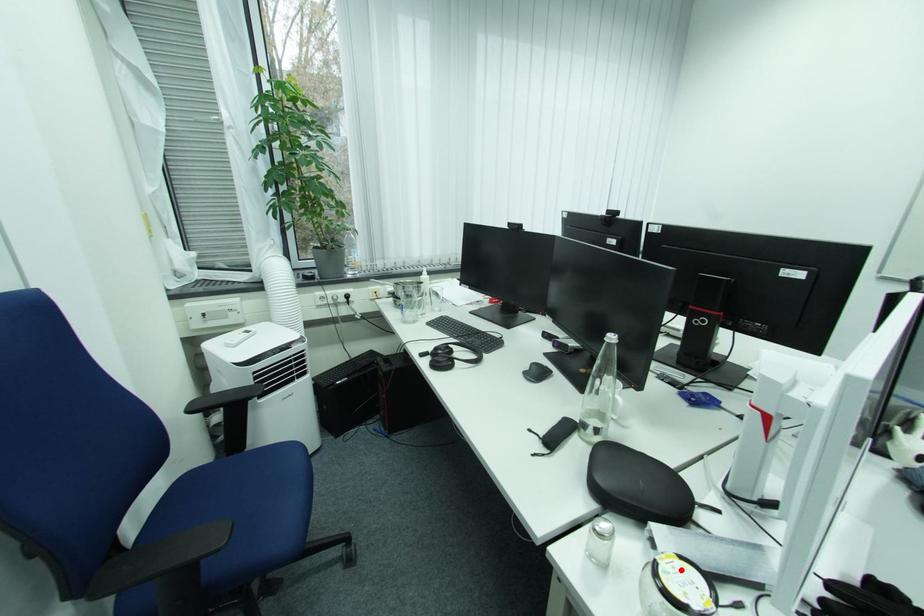
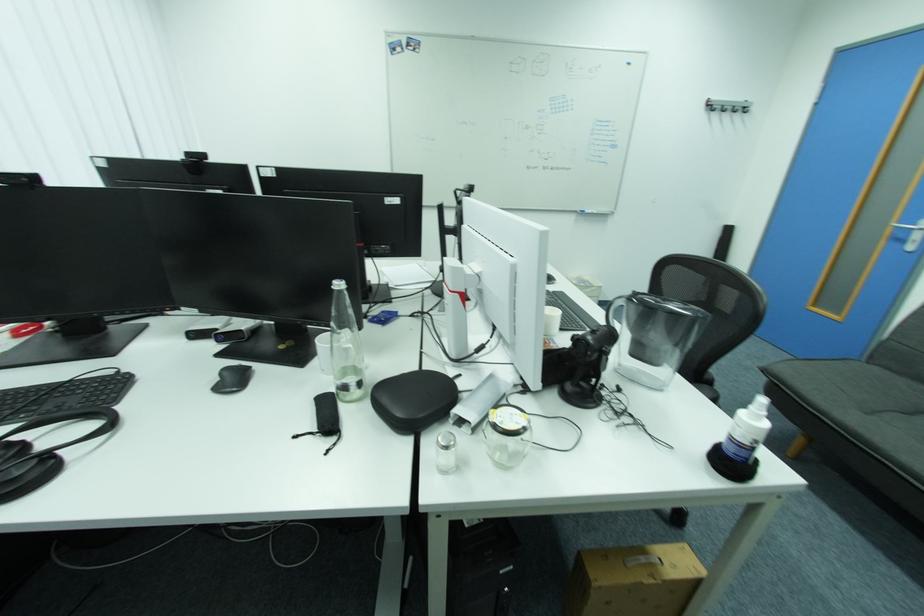
Question: I am providing you with two images of the same scene from different viewpoints. Given a red point in image1, look at the same physical point in image2. Is it:

Choices:
 (A) Closer to the viewpoint
 (B) Farther from the viewpoint

Answer: (A)